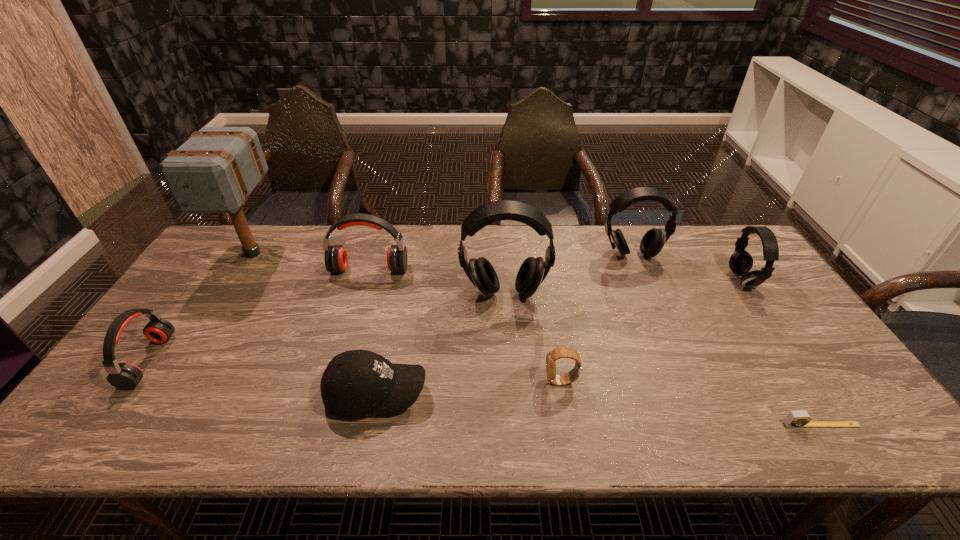
Where is `blank area in the image that satisfies the following two spatial constraints: 1. on the ear cups of the rightmost earphone; 2. on the ear cups of the leftmost black earphone`? This screenshot has width=960, height=540. blank area in the image that satisfies the following two spatial constraints: 1. on the ear cups of the rightmost earphone; 2. on the ear cups of the leftmost black earphone is located at coordinates [751, 293].